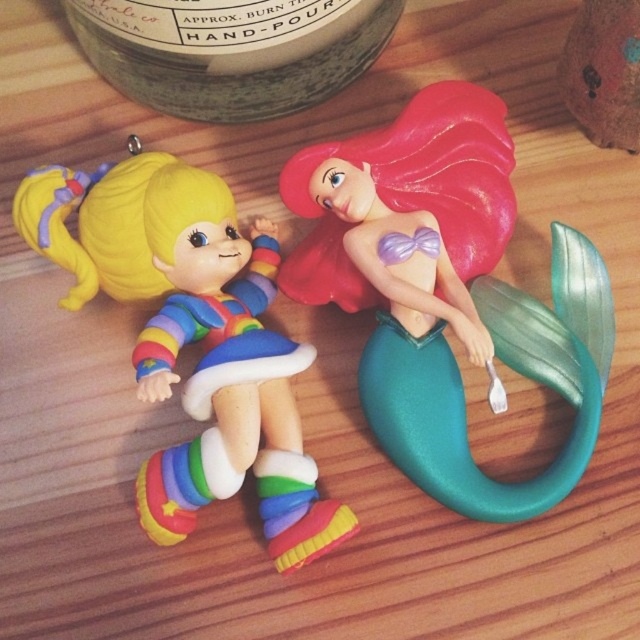
You are organizing a display and need to place the rainbow plastic doll at left and the green matte jar at upper center on a shelf. If the shelf has limited space, which object should you prioritize placing first to ensure both fit?

The rainbow plastic doll at left has a lesser width compared to the green matte jar at upper center, so you should prioritize placing the green matte jar at upper center first to accommodate its larger size and ensure both fit on the shelf.

You are a robot trying to navigate between two points on a wooden surface. The first point is point (180, 285) and the second point is point (620, 52). Which point is closer to you if you are facing the direction of the mermaid figurine?

Point (620, 52) is closer to you because it is in front of point (180, 285) when facing the mermaid figurine.